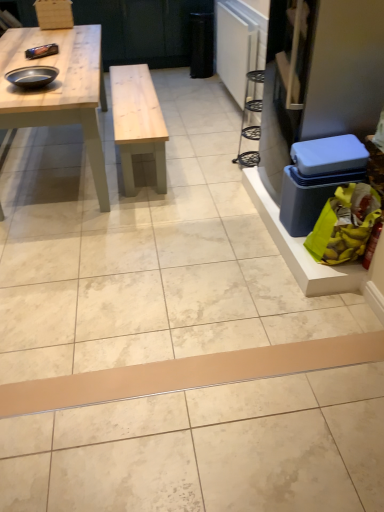
Identify the location of vacant location below black matte bowl at upper left (from a real-world perspective). (44, 84).